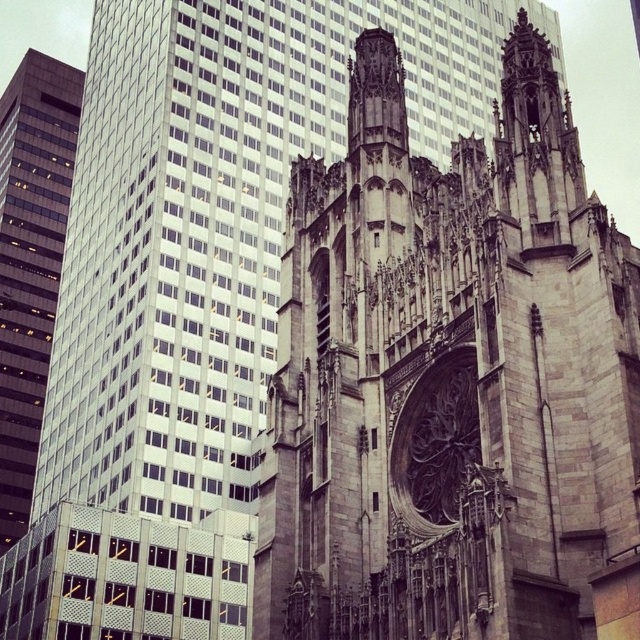
Question: Does gray stone cathedral at center have a greater width compared to matte glass skyscraper at left?

Choices:
 (A) no
 (B) yes

Answer: (A)

Question: Which of the following is the farthest from the observer?

Choices:
 (A) gray stone cathedral at center
 (B) matte glass skyscraper at left

Answer: (B)

Question: Which point is farther from the camera taking this photo?

Choices:
 (A) (17, 156)
 (B) (547, 56)

Answer: (A)

Question: Is gray stone cathedral at center positioned at the back of matte glass skyscraper at left?

Choices:
 (A) yes
 (B) no

Answer: (B)

Question: Does gray stone cathedral at center come behind matte glass skyscraper at left?

Choices:
 (A) yes
 (B) no

Answer: (B)